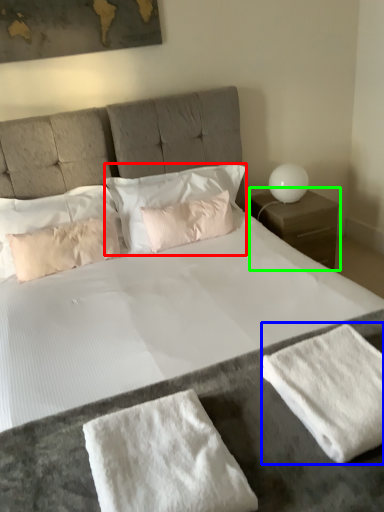
Question: Considering the real-world distances, which object is closest to pillow (highlighted by a red box)? bath towel (highlighted by a blue box) or nightstand (highlighted by a green box).

Choices:
 (A) bath towel
 (B) nightstand

Answer: (B)